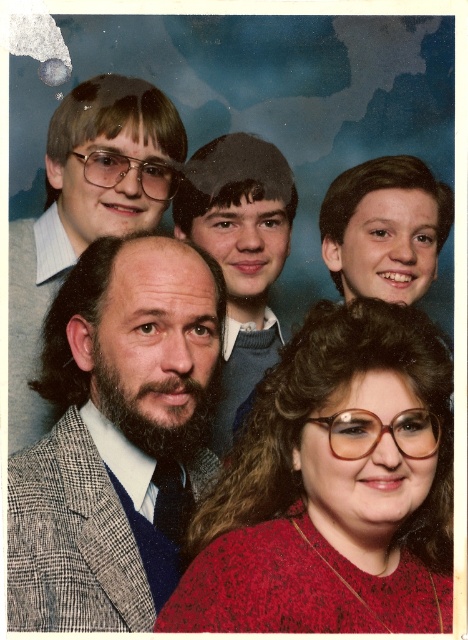
Question: Does knitted red sweater at center have a lesser width compared to bearded man at center?

Choices:
 (A) no
 (B) yes

Answer: (A)

Question: Which point appears closest to the camera in this image?

Choices:
 (A) (105, 285)
 (B) (35, 224)

Answer: (A)

Question: Among these objects, which one is farthest from the camera?

Choices:
 (A) knitted red sweater at center
 (B) gray checkered suit at center

Answer: (B)

Question: Is knitted red sweater at center bigger than smooth gray sweater at center?

Choices:
 (A) no
 (B) yes

Answer: (B)

Question: Among these points, which one is farthest from the camera?

Choices:
 (A) (170, 189)
 (B) (225, 372)
 (C) (43, 513)

Answer: (B)

Question: Is gray checkered suit at center bigger than smooth gray sweater at center?

Choices:
 (A) no
 (B) yes

Answer: (B)